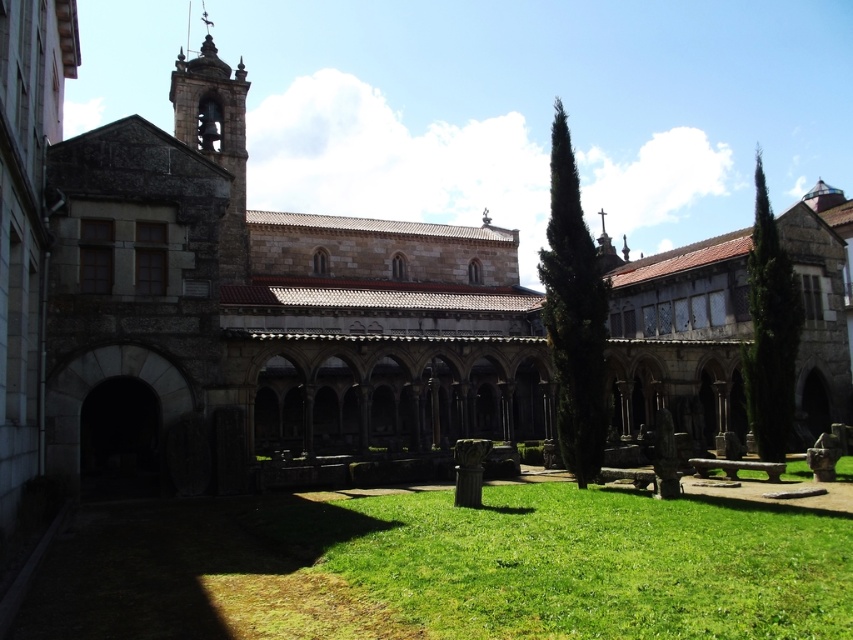
You are standing in the courtyard and want to place a 50 meter long temporary walkway from the green grass at lower center to the stone bell tower at upper left. Is this feasible?

The distance between the green grass at lower center and the stone bell tower at upper left is 48.29 meters, so a 50 meter walkway would be too long and not feasible.